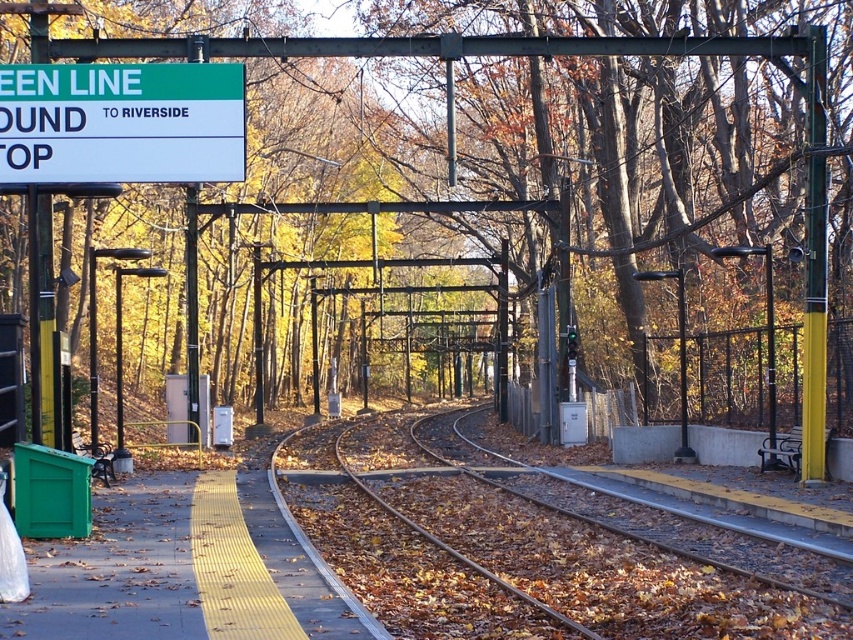
Question: Among these points, which one is farthest from the camera?

Choices:
 (A) (520, 611)
 (B) (76, 163)

Answer: (B)

Question: Can you confirm if brown leaf-covered tracks at center is positioned to the left of green plastic sign at upper left?

Choices:
 (A) no
 (B) yes

Answer: (A)

Question: Is brown leaf-covered tracks at center positioned at the back of green plastic sign at upper left?

Choices:
 (A) yes
 (B) no

Answer: (B)

Question: Does brown leaf-covered tracks at center appear on the right side of green plastic sign at upper left?

Choices:
 (A) no
 (B) yes

Answer: (B)

Question: Which of the following is the farthest from the observer?

Choices:
 (A) (331, 518)
 (B) (105, 67)

Answer: (A)

Question: Which point appears farthest from the camera in this image?

Choices:
 (A) (128, 157)
 (B) (320, 465)

Answer: (B)